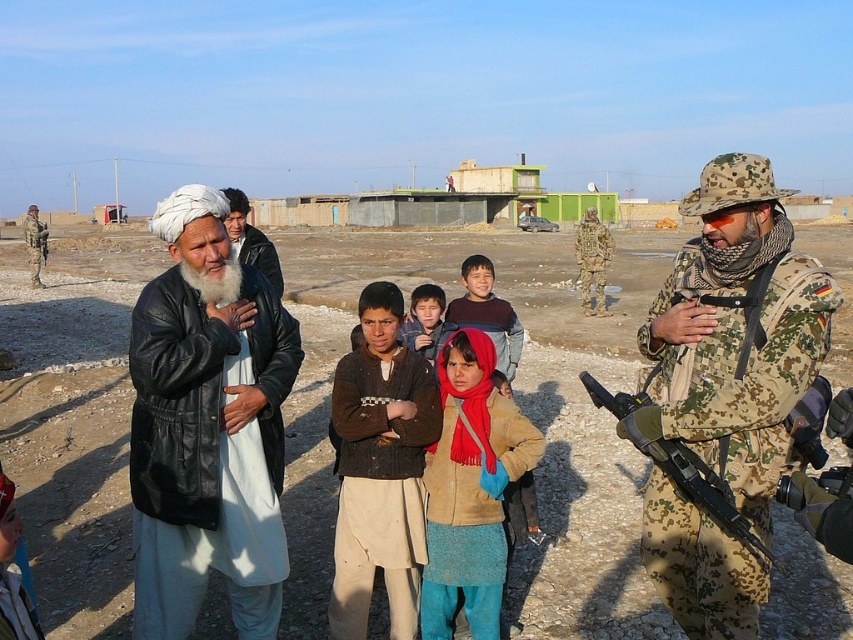
Does leather jacket at center have a greater height compared to camo fabric rifle at center?

Yes.

Between leather jacket at center and camo fabric rifle at center, which one appears on the left side from the viewer's perspective?

camo fabric rifle at center

Where is `leather jacket at center`? This screenshot has width=853, height=640. leather jacket at center is located at coordinates (207, 428).

Which is more to the left, brown wool sweater at center or camo fabric rifle at center?

From the viewer's perspective, camo fabric rifle at center appears more on the left side.

Which is in front, point (372, 518) or point (45, 252)?

Positioned in front is point (372, 518).

You are a GUI agent. You are given a task and a screenshot of the screen. Output one action in this format:
    pyautogui.click(x=<x>, y=<y>)
    Task: Click on the brown wool sweater at center
    
    Given the screenshot: What is the action you would take?
    pyautogui.click(x=380, y=468)

Is red scarf at center to the left of white woolen turban at center from the viewer's perspective?

Incorrect, red scarf at center is not on the left side of white woolen turban at center.

Is red scarf at center in front of white woolen turban at center?

No, red scarf at center is further to the viewer.

Which is in front, point (469, 564) or point (242, 230)?

Point (469, 564)

Identify the location of red scarf at center. 469,490.